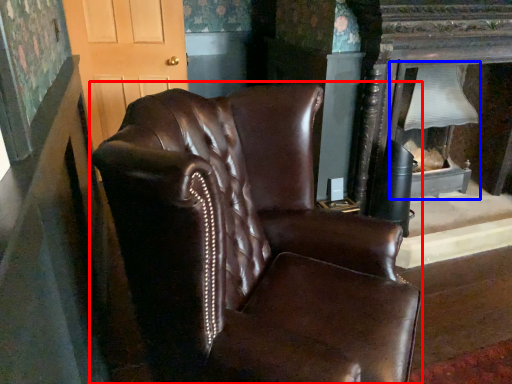
Question: Which point is further to the camera, chair (highlighted by a red box) or fireplace (highlighted by a blue box)?

Choices:
 (A) chair
 (B) fireplace

Answer: (B)